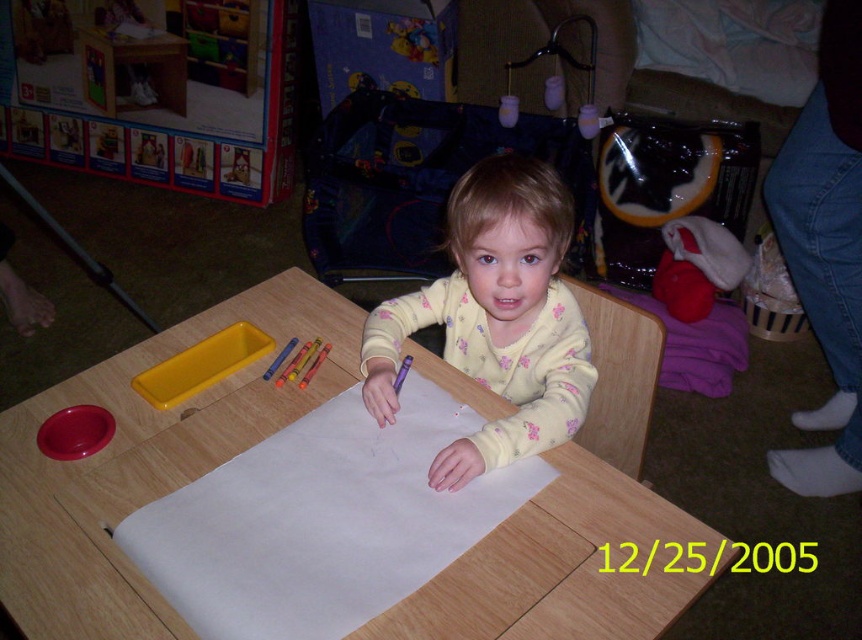
Question: Among these objects, which one is farthest from the camera?

Choices:
 (A) white paper at center
 (B) fluffy yellow pajamas at center

Answer: (B)

Question: Is wooden table at center positioned behind fluffy yellow pajamas at center?

Choices:
 (A) yes
 (B) no

Answer: (B)

Question: Which of the following is the farthest from the observer?

Choices:
 (A) wooden table at center
 (B) fluffy yellow pajamas at center

Answer: (B)

Question: Considering the relative positions of wooden table at center and fluffy yellow pajamas at center in the image provided, where is wooden table at center located with respect to fluffy yellow pajamas at center?

Choices:
 (A) left
 (B) right

Answer: (A)

Question: Based on their relative distances, which object is farther from the fluffy yellow pajamas at center?

Choices:
 (A) white paper at center
 (B) wooden table at center

Answer: (B)

Question: Is wooden table at center to the left of white paper at center from the viewer's perspective?

Choices:
 (A) no
 (B) yes

Answer: (A)